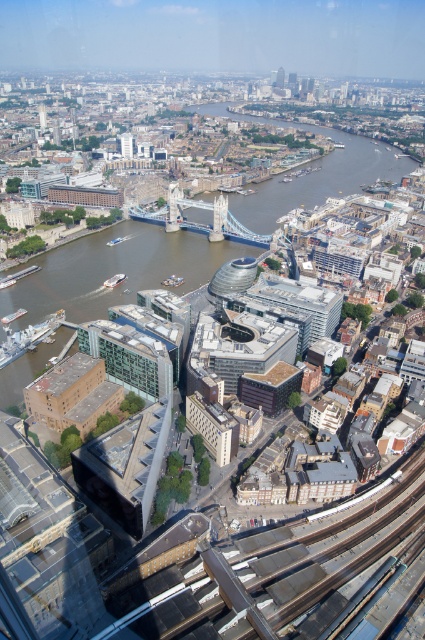
Is brown water at center shorter than green glass windows at center?

No, brown water at center is not shorter than green glass windows at center.

How distant is brown water at center from green glass windows at center?

brown water at center is 76.40 meters from green glass windows at center.

Which is behind, point (121, 284) or point (102, 349)?

The point (121, 284) is more distant.

Find the location of `brown water at center`. brown water at center is located at coordinates (115, 269).

Which is below, green glass windows at center or silver metallic bridge at center?

green glass windows at center is below.

Does green glass windows at center come in front of silver metallic bridge at center?

Yes, green glass windows at center is in front of silver metallic bridge at center.

This screenshot has width=425, height=640. In order to click on green glass windows at center in this screenshot , I will do `click(130, 364)`.

Which is more to the right, brown water at center or matte gray tower at upper center?

Positioned to the right is brown water at center.

Can you confirm if brown water at center is taller than matte gray tower at upper center?

Correct, brown water at center is much taller as matte gray tower at upper center.

Is point (184, 248) more distant than point (121, 140)?

That is False.

Find the location of a particular element. The image size is (425, 640). brown water at center is located at coordinates (115, 269).